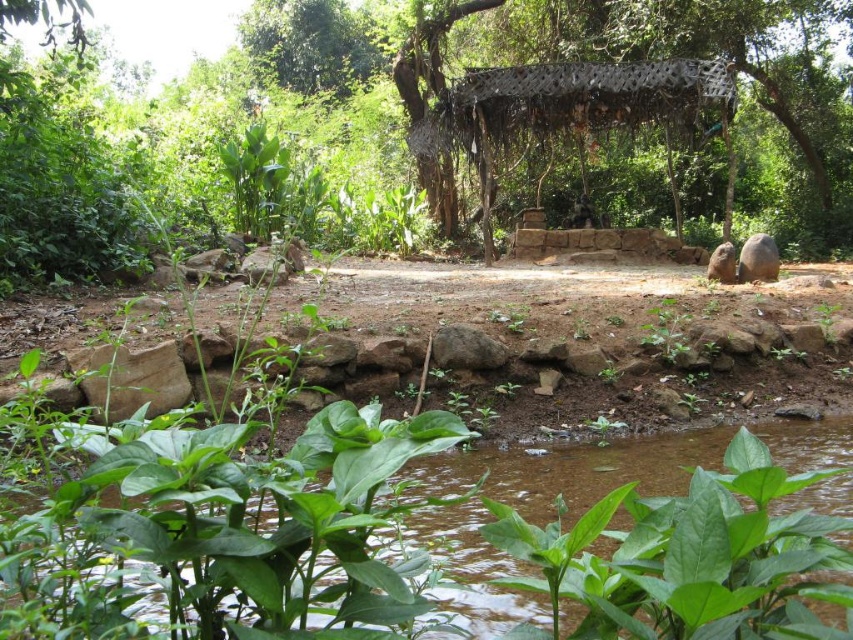
You are standing in the garden and want to reach the point at coordinates point (x=366, y=544). If your maximum reach is 8 feet, can you touch it without moving closer?

The point (x=366, y=544) is 8.74 feet away from the viewer, which exceeds your maximum reach of 8 feet. You cannot touch it without moving closer.

Consider the image. You are planning to place a small statue in the garden scene. The statue requires a base that is larger than the green leafy water at bottom. Can you use the rusty metal canopy at center as the base? Please explain your reasoning.

The green leafy water at bottom is smaller than the rusty metal canopy at center. Since the rusty metal canopy at center is larger, it can serve as a suitable base for the statue as it meets the size requirement of being larger than the green leafy water at bottom.

You are standing in the garden and want to walk from the green leafy water at bottom to the rusty metal canopy at center. Which direction should you move?

You should move upward towards the rusty metal canopy at center because the green leafy water at bottom is located below it.